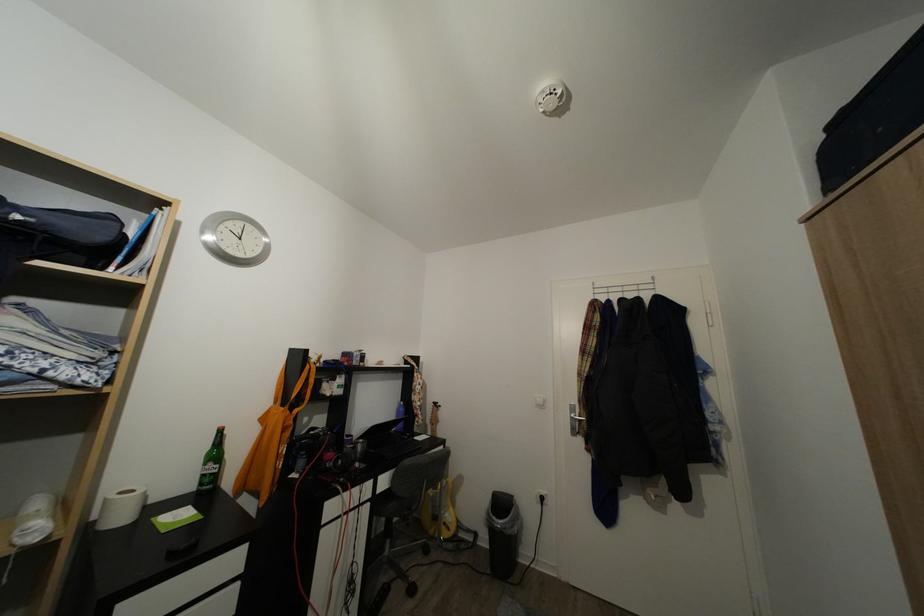
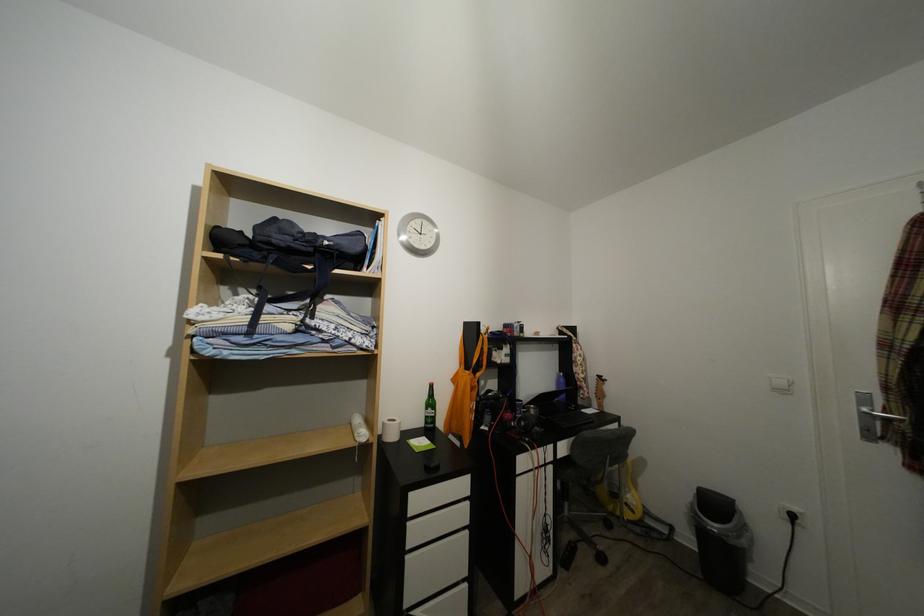
Question: The images are taken continuously from a first-person perspective. In which direction are you moving?

Choices:
 (A) Left
 (B) Right
 (C) Forward
 (D) Backward

Answer: (A)